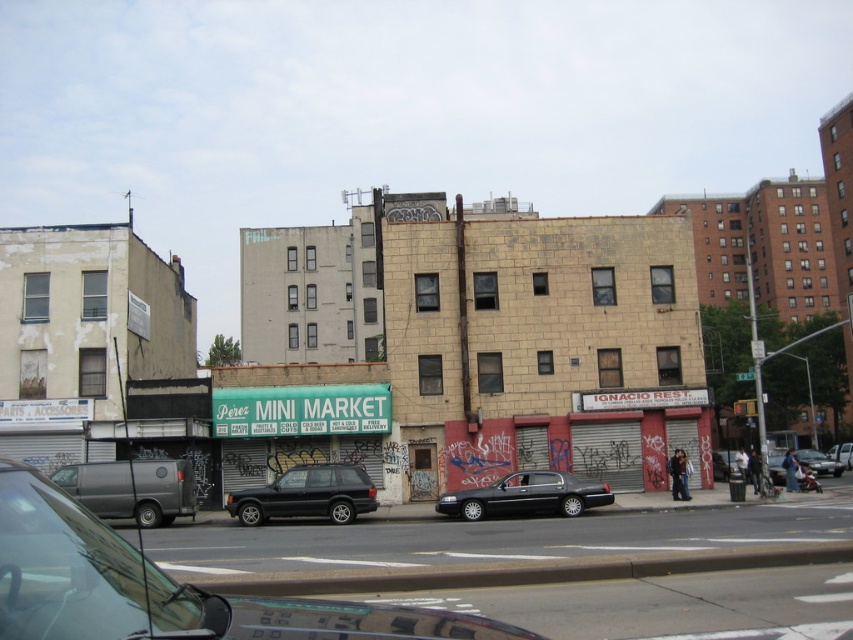
Can you confirm if black matte suv at center is positioned to the right of silver metallic suv at center?

Incorrect, black matte suv at center is not on the right side of silver metallic suv at center.

Is point (804, 452) closer to camera compared to point (834, 456)?

Yes, it is.

Image resolution: width=853 pixels, height=640 pixels. What are the coordinates of `black matte suv at center` in the screenshot? It's located at (817, 461).

Between shiny black suv at center and black matte suv at center, which one appears on the right side from the viewer's perspective?

black matte suv at center

Does shiny black suv at center lie behind black matte suv at center?

That is False.

Between point (368, 480) and point (820, 470), which one is positioned behind?

The point (820, 470) is behind.

Where is `shiny black suv at center`? The image size is (853, 640). shiny black suv at center is located at coordinates (306, 493).

Is point (352, 502) farther from viewer compared to point (524, 493)?

Yes, it is behind point (524, 493).

Which is behind, point (250, 497) or point (483, 497)?

Positioned behind is point (250, 497).

Which is in front, point (262, 508) or point (572, 484)?

Positioned in front is point (262, 508).

Find the location of a particular element. shiny black suv at center is located at coordinates (306, 493).